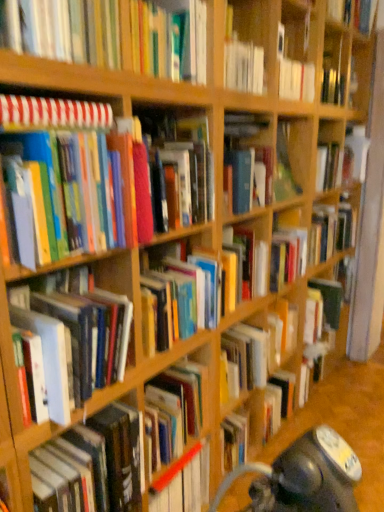
Question: Do you think striped paper notebook at upper left, the sixth book from the bottom, is within hardcover book at upper center, arranged as the second book when viewed from the top, or outside of it?

Choices:
 (A) inside
 (B) outside

Answer: (B)

Question: From a real-world perspective, is striped paper notebook at upper left, the sixth book from the bottom, above or below hardcover book at upper center, the 7th book positioned from the bottom?

Choices:
 (A) above
 (B) below

Answer: (B)

Question: Estimate the real-world distances between objects in this image. Which object is farther from the matte hardcover books at left, marked as the fourth book in a bottom-to-top arrangement?

Choices:
 (A) hardcover book at center, arranged as the fifth book when ordered from the bottom
 (B) hardcover book at left, placed as the 3th book when sorted from bottom to top
 (C) hardcover book at center, the seventh book when ordered from top to bottom
 (D) striped paper notebook at upper left, the sixth book from the bottom
 (E) hardcover book at upper center, the 7th book positioned from the bottom

Answer: (A)

Question: Which object is the farthest from the hardcover book at center, positioned as the second book in bottom-to-top order?

Choices:
 (A) hardcover book at left, acting as the sixth book starting from the top
 (B) hardcover book at center, arranged as the fifth book when ordered from the bottom
 (C) hardcover book at upper center, the 7th book positioned from the bottom
 (D) hardcover book at upper right, the eighth book ordered from the bottom
 (E) matte hardcover books at left, marked as the fourth book in a bottom-to-top arrangement

Answer: (D)